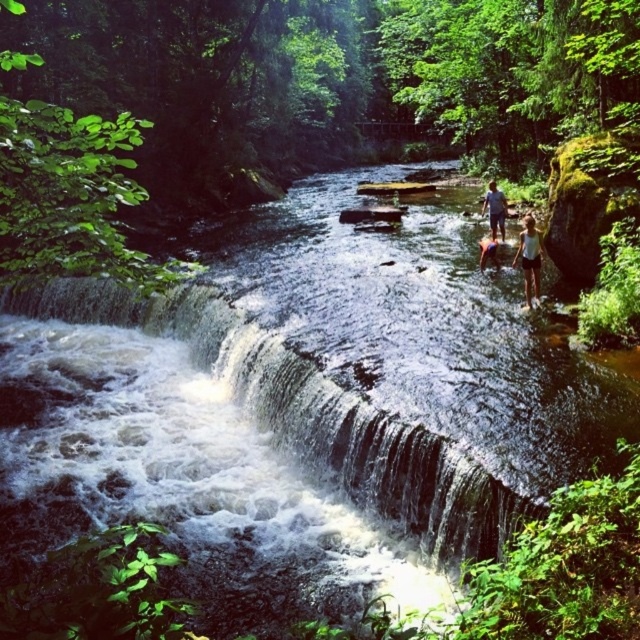
Does brown fabric shorts at center appear on the left side of orange life vest at center?

In fact, brown fabric shorts at center is to the right of orange life vest at center.

Is point (492, 224) closer to viewer compared to point (493, 246)?

No, it is not.

Where is `brown fabric shorts at center`? brown fabric shorts at center is located at coordinates (493, 209).

Based on the photo, who is higher up, white cotton tank top at center or orange life vest at center?

Positioned higher is orange life vest at center.

Is white cotton tank top at center behind orange life vest at center?

No, it is not.

Between point (531, 220) and point (480, 240), which one is positioned behind?

The point (480, 240) is behind.

Locate an element on the screen. The image size is (640, 640). white cotton tank top at center is located at coordinates (529, 259).

Does point (522, 243) come behind point (492, 204)?

That is False.

Find the location of a particular element. white cotton tank top at center is located at coordinates (529, 259).